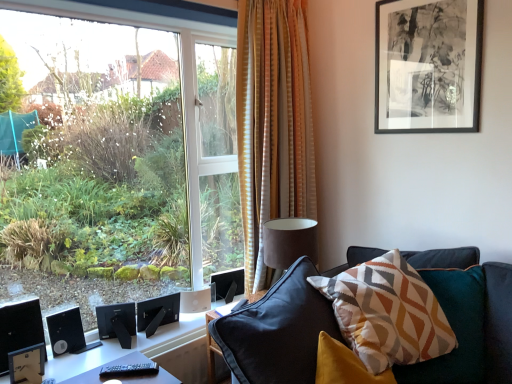
You are a GUI agent. You are given a task and a screenshot of the screen. Output one action in this format:
    pyautogui.click(x=<x>, y=<y>)
    Task: Click on the free location to the right of black glossy monitor at lower left
    The height and width of the screenshot is (384, 512).
    Given the screenshot: What is the action you would take?
    pyautogui.click(x=65, y=365)